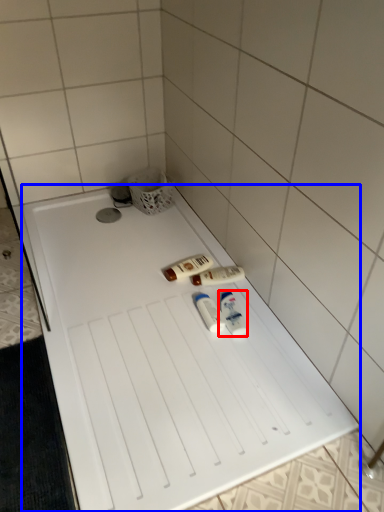
Question: Which point is closer to the camera, toiletry (highlighted by a red box) or furniture (highlighted by a blue box)?

Choices:
 (A) toiletry
 (B) furniture

Answer: (B)